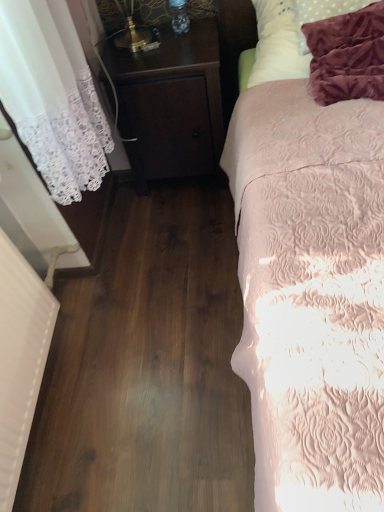
Question: In terms of size, does white soft pillow at upper right appear bigger or smaller than pink quilted bed at right?

Choices:
 (A) big
 (B) small

Answer: (B)

Question: Is white soft pillow at upper right spatially inside pink quilted bed at right, or outside of it?

Choices:
 (A) outside
 (B) inside

Answer: (B)

Question: Estimate the real-world distances between objects in this image. Which object is farther from the pink quilted bed at right?

Choices:
 (A) dark wood nightstand at center
 (B) white soft pillow at upper right

Answer: (A)

Question: Which object is positioned farthest from the dark wood nightstand at center?

Choices:
 (A) white soft pillow at upper right
 (B) pink quilted bed at right

Answer: (B)